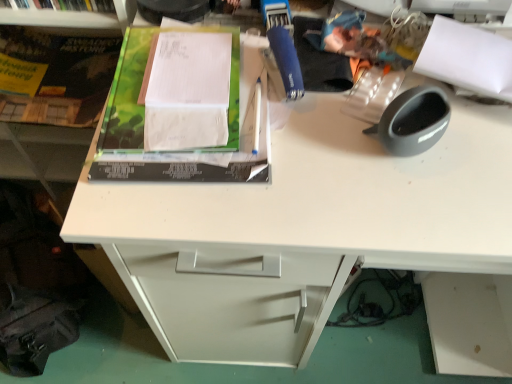
Question: Can you confirm if green matte book at upper left is smaller than green matte paper at upper left, the 2th paperback book viewed from the back?

Choices:
 (A) yes
 (B) no

Answer: (B)

Question: Does green matte book at upper left have a lesser height compared to green matte paper at upper left, the second paperback book when ordered from left to right?

Choices:
 (A) no
 (B) yes

Answer: (A)

Question: From the image's perspective, is green matte book at upper left under green matte paper at upper left, marked as the first paperback book in a front-to-back arrangement?

Choices:
 (A) yes
 (B) no

Answer: (B)

Question: From a real-world perspective, is green matte book at upper left over green matte paper at upper left, arranged as the 1th paperback book when viewed from the right?

Choices:
 (A) no
 (B) yes

Answer: (A)

Question: Would you say green matte book at upper left contains green matte paper at upper left, arranged as the 1th paperback book when viewed from the right?

Choices:
 (A) yes
 (B) no

Answer: (B)

Question: Considering the positions of green matte paper at upper left, the second paperback book when ordered from left to right, and white plastic shelf at upper left in the image, is green matte paper at upper left, the second paperback book when ordered from left to right, wider or thinner than white plastic shelf at upper left?

Choices:
 (A) thin
 (B) wide

Answer: (B)

Question: From the image's perspective, is green matte paper at upper left, arranged as the 1th paperback book when viewed from the right, positioned above or below white plastic shelf at upper left?

Choices:
 (A) above
 (B) below

Answer: (B)

Question: Based on their sizes in the image, would you say green matte paper at upper left, the 2th paperback book viewed from the back, is bigger or smaller than white plastic shelf at upper left?

Choices:
 (A) small
 (B) big

Answer: (A)

Question: Based on their positions, is green matte paper at upper left, the second paperback book when ordered from left to right, located to the left or right of white plastic shelf at upper left?

Choices:
 (A) left
 (B) right

Answer: (B)

Question: From a real-world perspective, relative to green matte book at upper left, is hardcover book at upper left, the second paperback book viewed from the front, vertically above or below?

Choices:
 (A) above
 (B) below

Answer: (A)

Question: In terms of width, does hardcover book at upper left, the second paperback book viewed from the front, look wider or thinner when compared to green matte book at upper left?

Choices:
 (A) thin
 (B) wide

Answer: (B)

Question: Is point (18, 59) closer or farther from the camera than point (15, 96)?

Choices:
 (A) closer
 (B) farther

Answer: (B)

Question: From their relative heights in the image, would you say hardcover book at upper left, which appears as the 1th paperback book when viewed from the back, is taller or shorter than green matte book at upper left?

Choices:
 (A) short
 (B) tall

Answer: (A)

Question: Is point (32, 144) positioned closer to the camera than point (169, 129)?

Choices:
 (A) farther
 (B) closer

Answer: (A)

Question: Based on their sizes in the image, would you say green matte book at upper left is bigger or smaller than green matte paper at upper left, arranged as the 1th paperback book when viewed from the right?

Choices:
 (A) small
 (B) big

Answer: (B)